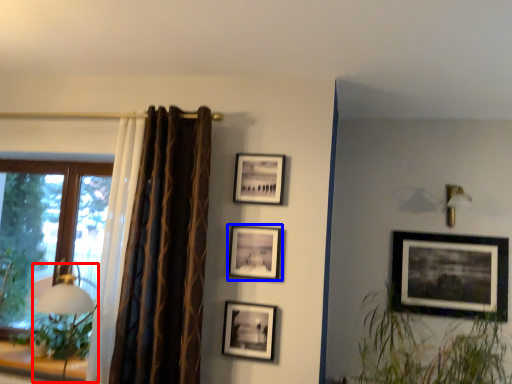
Question: Which object appears closest to the camera in this image, table lamp (highlighted by a red box) or picture frame (highlighted by a blue box)?

Choices:
 (A) table lamp
 (B) picture frame

Answer: (A)